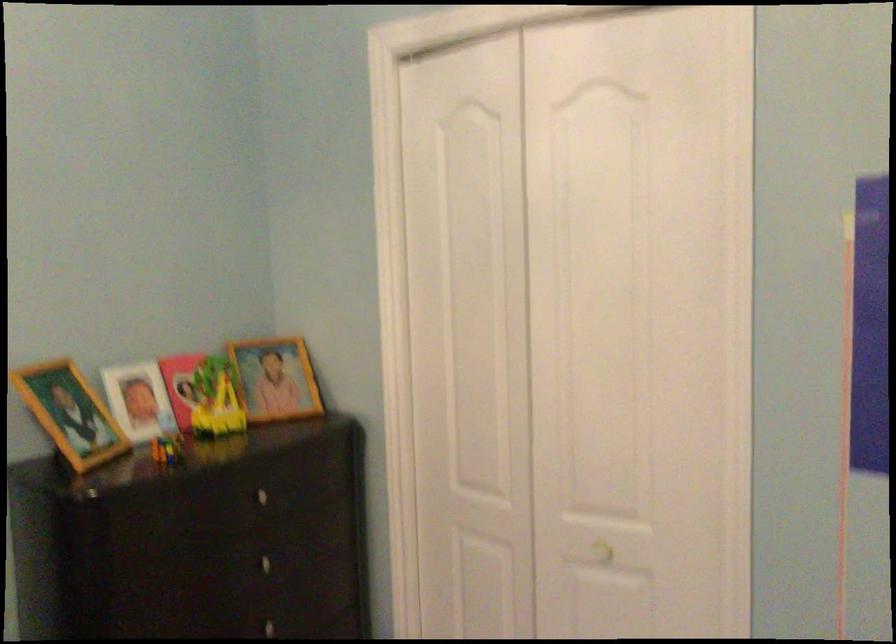
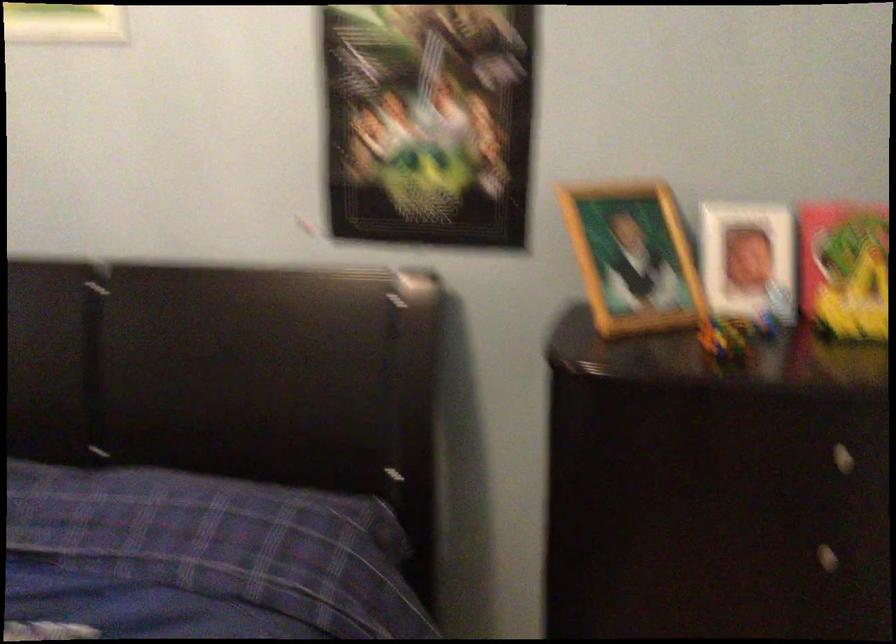
First-person continuous shooting, in which direction is the camera rotating?

The camera's rotation is toward left-down.